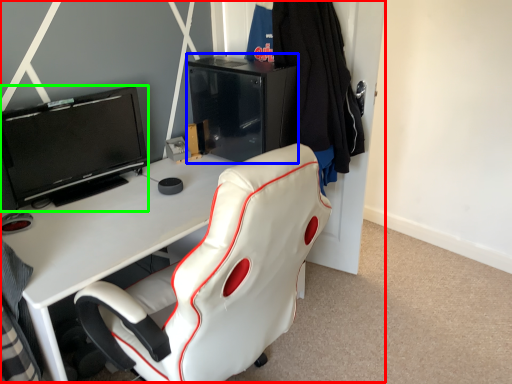
Question: Considering the real-world distances, which object is closest to entertainment center (highlighted by a red box)? file cabinet (highlighted by a blue box) or television (highlighted by a green box).

Choices:
 (A) file cabinet
 (B) television

Answer: (A)